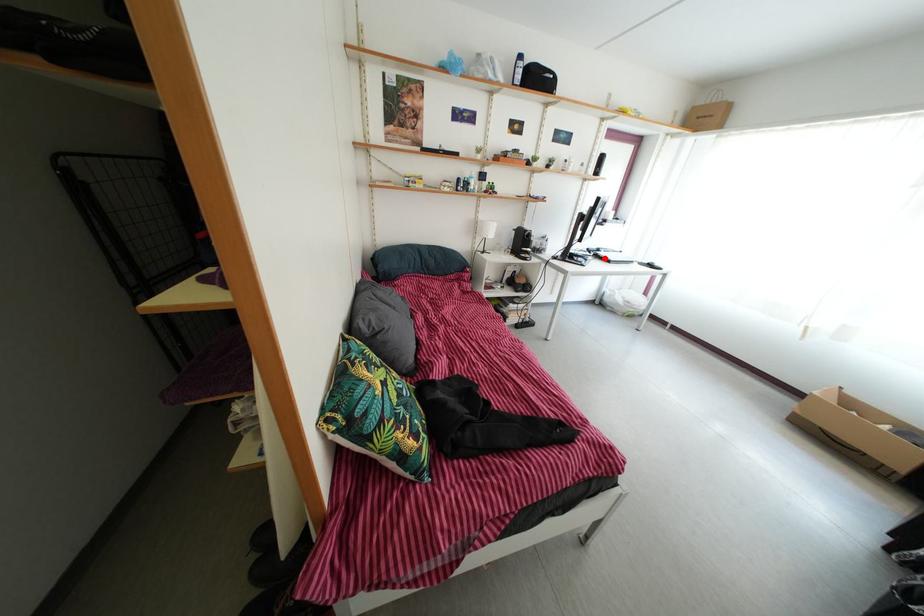
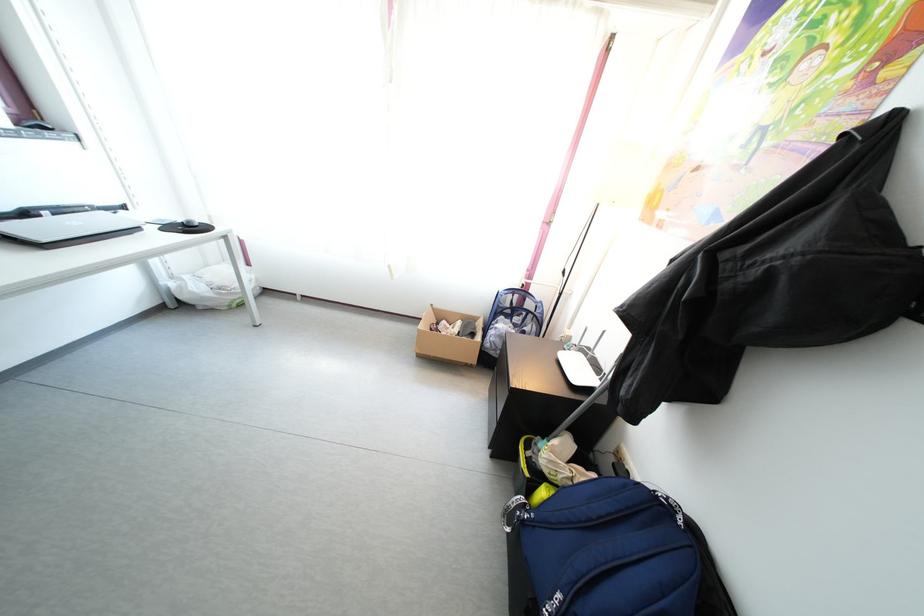
Question: I am providing you with two images of the same scene from different viewpoints. A red point is shown in image1. For the corresponding object point in image2, is it positioned nearer or farther from the camera?

Choices:
 (A) Nearer
 (B) Farther

Answer: (B)